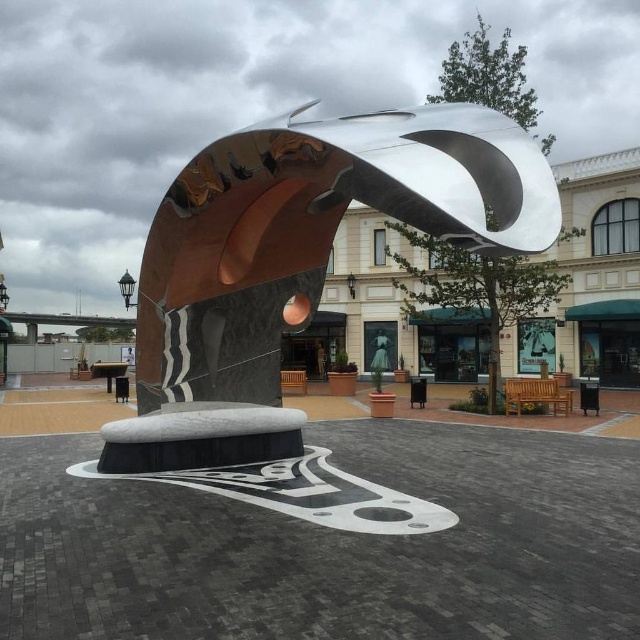
Question: Can you confirm if polished metal sculpture at center is positioned above polished silver sculpture at center?

Choices:
 (A) no
 (B) yes

Answer: (B)

Question: Among these objects, which one is farthest from the camera?

Choices:
 (A) polished metal sculpture at center
 (B) polished silver sculpture at center

Answer: (B)

Question: Does polished metal sculpture at center appear on the left side of polished silver sculpture at center?

Choices:
 (A) yes
 (B) no

Answer: (A)

Question: Which of the following is the closest to the observer?

Choices:
 (A) (579, 237)
 (B) (285, 176)

Answer: (B)

Question: Can you confirm if polished metal sculpture at center is wider than polished silver sculpture at center?

Choices:
 (A) no
 (B) yes

Answer: (A)